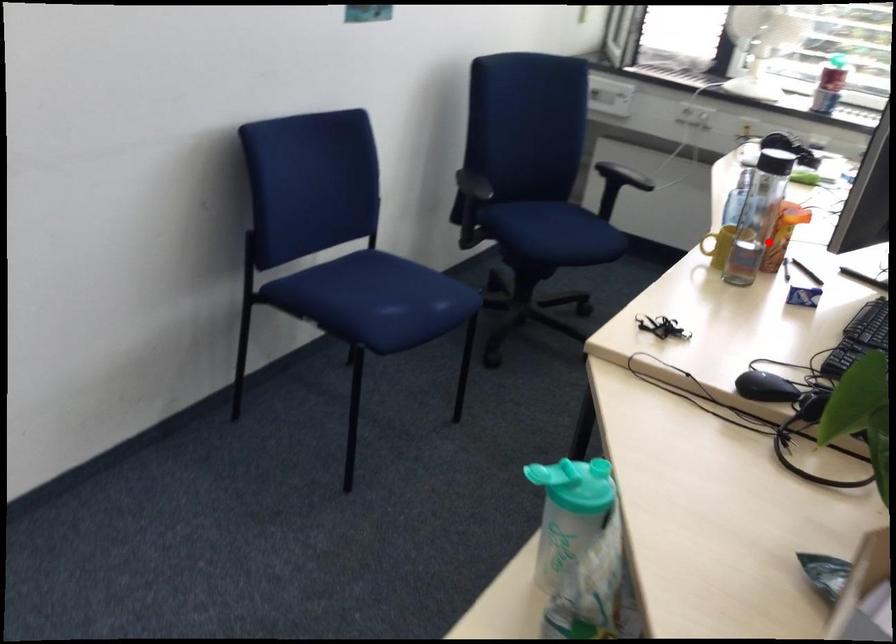
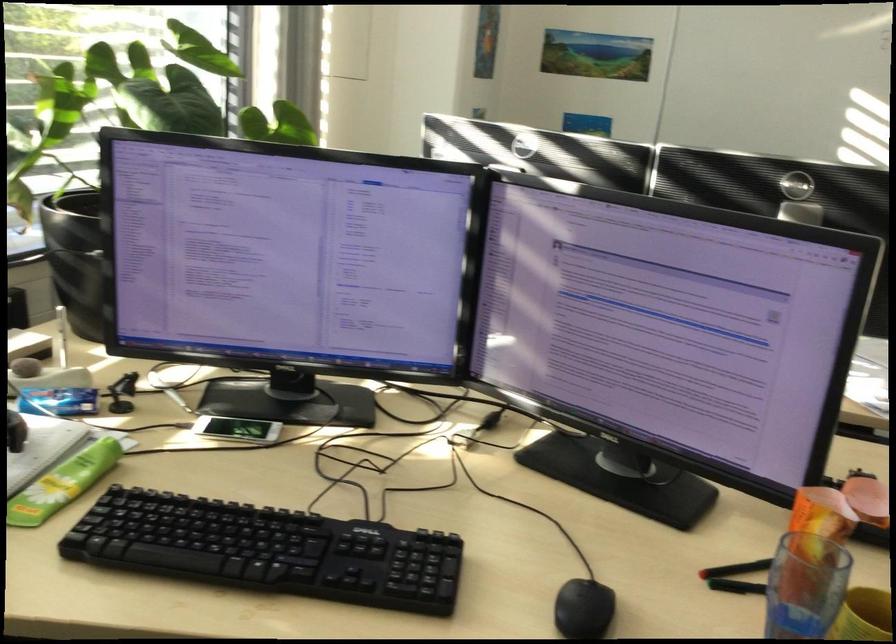
Locate, in the second image, the point that corresponds to the highlighted location in the first image.

(805, 585)